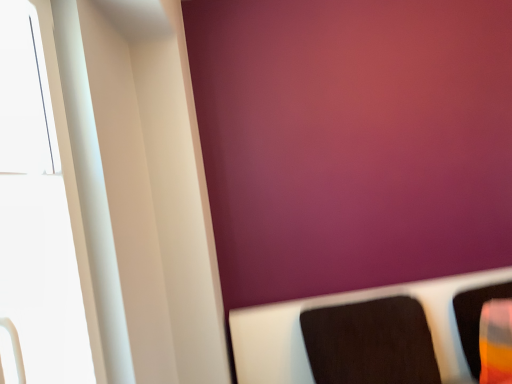
Question: Is black fabric cushion at lower right, which appears as the first furniture when viewed from the left, in front of or behind translucent plastic cup at right, the 1th furniture when ordered from right to left, in the image?

Choices:
 (A) front
 (B) behind

Answer: (A)

Question: Considering the positions of black fabric cushion at lower right, placed as the 2th furniture when sorted from right to left, and translucent plastic cup at right, which is the second furniture in left-to-right order, in the image, is black fabric cushion at lower right, placed as the 2th furniture when sorted from right to left, wider or thinner than translucent plastic cup at right, which is the second furniture in left-to-right order,?

Choices:
 (A) thin
 (B) wide

Answer: (B)

Question: Estimate the real-world distances between objects in this image. Which object is farther from the black fabric cushion at lower right, placed as the 2th furniture when sorted from right to left?

Choices:
 (A) translucent plastic cup at right, which is the second furniture in left-to-right order
 (B) white glossy window at left

Answer: (B)

Question: Estimate the real-world distances between objects in this image. Which object is farther from the black fabric cushion at lower right, placed as the 2th furniture when sorted from right to left?

Choices:
 (A) white glossy window at left
 (B) translucent plastic cup at right, which is the second furniture in left-to-right order

Answer: (A)